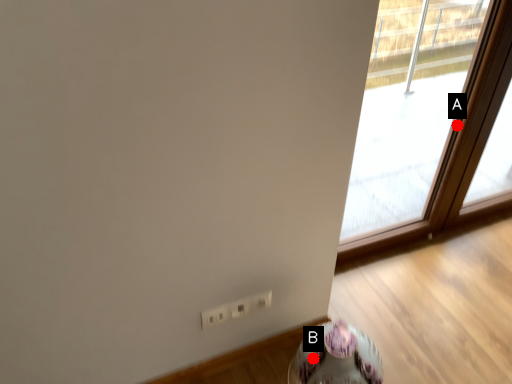
Question: Two points are circled on the image, labeled by A and B beside each circle. Which point is closer to the camera?

Choices:
 (A) A is closer
 (B) B is closer

Answer: (B)